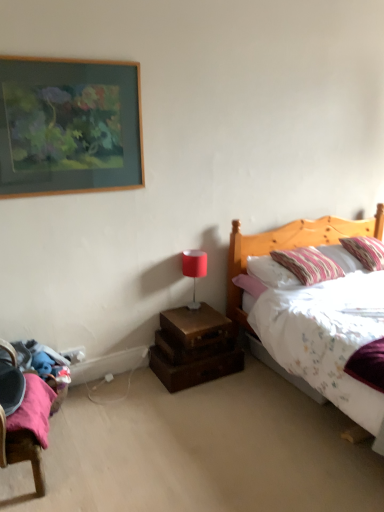
In order to click on empty space that is ontop of wooden picture frame at upper left (from a real-world perspective) in this screenshot , I will do `click(61, 57)`.